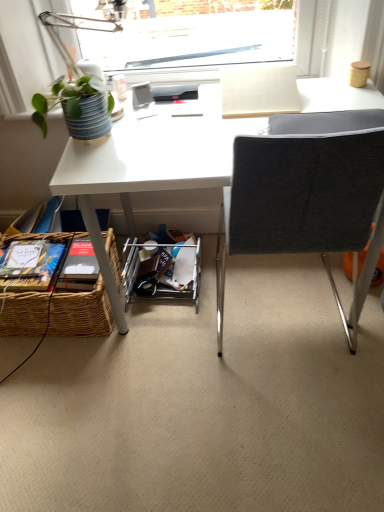
In order to face metal/mesh shelf at lower center, should I rotate leftwards or rightwards?

You should rotate left by 3.528 degrees.

Identify the location of dark gray fabric chair at center. This screenshot has width=384, height=512. (303, 194).

The image size is (384, 512). Describe the element at coordinates (81, 312) in the screenshot. I see `woven brown picnic basket at lower left` at that location.

Measure the distance between green matte plant at upper left and camera.

A distance of 1.19 meters exists between green matte plant at upper left and camera.

The height and width of the screenshot is (512, 384). What do you see at coordinates (75, 65) in the screenshot? I see `matte white table lamp at upper left` at bounding box center [75, 65].

The height and width of the screenshot is (512, 384). In order to click on metal/mesh shelf at lower center in this screenshot , I will do `click(164, 272)`.

Is the position of matte white table lamp at upper left less distant than that of metal/mesh shelf at lower center?

Yes, matte white table lamp at upper left is closer to the camera.

How different are the orientations of matte white table lamp at upper left and metal/mesh shelf at lower center in degrees?

2.55 degrees.

Is matte white table lamp at upper left positioned with its back to metal/mesh shelf at lower center?

No, matte white table lamp at upper left is not facing the opposite direction of metal/mesh shelf at lower center.

Is matte white table lamp at upper left not near metal/mesh shelf at lower center?

No, there isn't a large distance between matte white table lamp at upper left and metal/mesh shelf at lower center.

Considering the relative positions of dark gray fabric chair at center and matte white table lamp at upper left in the image provided, is dark gray fabric chair at center to the left or to the right of matte white table lamp at upper left?

In the image, dark gray fabric chair at center appears on the right side of matte white table lamp at upper left.

Is matte white table lamp at upper left at the back of dark gray fabric chair at center?

No, dark gray fabric chair at center is not facing away from matte white table lamp at upper left.

Would you say dark gray fabric chair at center is a long distance from matte white table lamp at upper left?

No, dark gray fabric chair at center is not far from matte white table lamp at upper left.

Can you confirm if dark gray fabric chair at center is taller than matte white table lamp at upper left?

Correct, dark gray fabric chair at center is much taller as matte white table lamp at upper left.

Is metal/mesh shelf at lower center taller or shorter than matte white table lamp at upper left?

metal/mesh shelf at lower center is shorter than matte white table lamp at upper left.

Find the location of `shelf lying below the matte white table lamp at upper left (from the image's perspective)`. shelf lying below the matte white table lamp at upper left (from the image's perspective) is located at coordinates (164, 272).

From the image's perspective, who appears lower, metal/mesh shelf at lower center or matte white table lamp at upper left?

metal/mesh shelf at lower center, from the image's perspective.

Looking at this image, is woven brown picnic basket at lower left oriented away from metal/mesh shelf at lower center?

woven brown picnic basket at lower left does not have its back to metal/mesh shelf at lower center.

From the picture: Between woven brown picnic basket at lower left and metal/mesh shelf at lower center, which one has larger size?

Bigger between the two is woven brown picnic basket at lower left.

Based on the photo, from the image's perspective, relative to metal/mesh shelf at lower center, is woven brown picnic basket at lower left above or below?

woven brown picnic basket at lower left is below metal/mesh shelf at lower center.

Identify the location of plant above the metal/mesh shelf at lower center (from the image's perspective). The image size is (384, 512). (77, 106).

Can we say metal/mesh shelf at lower center lies outside green matte plant at upper left?

Yes, metal/mesh shelf at lower center is not within green matte plant at upper left.

Does point (173, 267) come in front of point (108, 116)?

No, (173, 267) is further to viewer.

Is metal/mesh shelf at lower center to the left or to the right of green matte plant at upper left in the image?

metal/mesh shelf at lower center is to the right of green matte plant at upper left.

From a real-world perspective, is dark gray fabric chair at center beneath metal/mesh shelf at lower center?

No, from a real-world perspective, dark gray fabric chair at center is not beneath metal/mesh shelf at lower center.

In the scene shown: Which is farther, (310, 146) or (161, 277)?

The point (161, 277) is behind.

How far apart are dark gray fabric chair at center and metal/mesh shelf at lower center?

23.37 inches.

Considering the relative positions of dark gray fabric chair at center and metal/mesh shelf at lower center in the image provided, is dark gray fabric chair at center to the right of metal/mesh shelf at lower center from the viewer's perspective?

Correct, you'll find dark gray fabric chair at center to the right of metal/mesh shelf at lower center.

Can you confirm if metal/mesh shelf at lower center is positioned to the right of woven brown picnic basket at lower left?

Indeed, metal/mesh shelf at lower center is positioned on the right side of woven brown picnic basket at lower left.

From a real-world perspective, which object stands above the other?

woven brown picnic basket at lower left is physically above.

Based on the photo, considering the sizes of objects metal/mesh shelf at lower center and woven brown picnic basket at lower left in the image provided, who is shorter, metal/mesh shelf at lower center or woven brown picnic basket at lower left?

Standing shorter between the two is metal/mesh shelf at lower center.

Is woven brown picnic basket at lower left surrounded by metal/mesh shelf at lower center?

No, woven brown picnic basket at lower left is not inside metal/mesh shelf at lower center.

Where is `shelf lying on the right of matte white table lamp at upper left`? shelf lying on the right of matte white table lamp at upper left is located at coordinates (164, 272).

Where is `chair lying in front of the matte white table lamp at upper left`? chair lying in front of the matte white table lamp at upper left is located at coordinates (303, 194).

Consider the image. When comparing their distances from metal/mesh shelf at lower center, does matte white table lamp at upper left or dark gray fabric chair at center seem closer?

The object closer to metal/mesh shelf at lower center is dark gray fabric chair at center.

From the image, which object appears to be farther from woven brown picnic basket at lower left, dark gray fabric chair at center or green matte plant at upper left?

Among the two, dark gray fabric chair at center is located further to woven brown picnic basket at lower left.

In the scene shown: Considering their positions, is woven brown picnic basket at lower left positioned further to dark gray fabric chair at center than matte white table lamp at upper left?

Based on the image, woven brown picnic basket at lower left appears to be further to dark gray fabric chair at center.

Estimate the real-world distances between objects in this image. Which object is further from metal/mesh shelf at lower center, dark gray fabric chair at center or woven brown picnic basket at lower left?

dark gray fabric chair at center.

Based on their spatial positions, is dark gray fabric chair at center or woven brown picnic basket at lower left further from green matte plant at upper left?

The object further to green matte plant at upper left is dark gray fabric chair at center.

Considering their positions, is matte white table lamp at upper left positioned closer to dark gray fabric chair at center than metal/mesh shelf at lower center?

Based on the image, metal/mesh shelf at lower center appears to be nearer to dark gray fabric chair at center.

From the image, which object appears to be nearer to green matte plant at upper left, woven brown picnic basket at lower left or dark gray fabric chair at center?

The object closer to green matte plant at upper left is woven brown picnic basket at lower left.

Estimate the real-world distances between objects in this image. Which object is closer to metal/mesh shelf at lower center, matte white table lamp at upper left or woven brown picnic basket at lower left?

woven brown picnic basket at lower left.

You are a GUI agent. You are given a task and a screenshot of the screen. Output one action in this format:
    pyautogui.click(x=<x>, y=<y>)
    Task: Click on the table lamp between dark gray fabric chair at center and metal/mesh shelf at lower center in the front-back direction
    
    Given the screenshot: What is the action you would take?
    pyautogui.click(x=75, y=65)

The width and height of the screenshot is (384, 512). Identify the location of shelf between matte white table lamp at upper left and woven brown picnic basket at lower left from top to bottom. (164, 272).

This screenshot has height=512, width=384. I want to click on plant between matte white table lamp at upper left and woven brown picnic basket at lower left from top to bottom, so click(x=77, y=106).

You are a GUI agent. You are given a task and a screenshot of the screen. Output one action in this format:
    pyautogui.click(x=<x>, y=<y>)
    Task: Click on the plant between dark gray fabric chair at center and metal/mesh shelf at lower center from front to back
    The height and width of the screenshot is (512, 384).
    Given the screenshot: What is the action you would take?
    pyautogui.click(x=77, y=106)